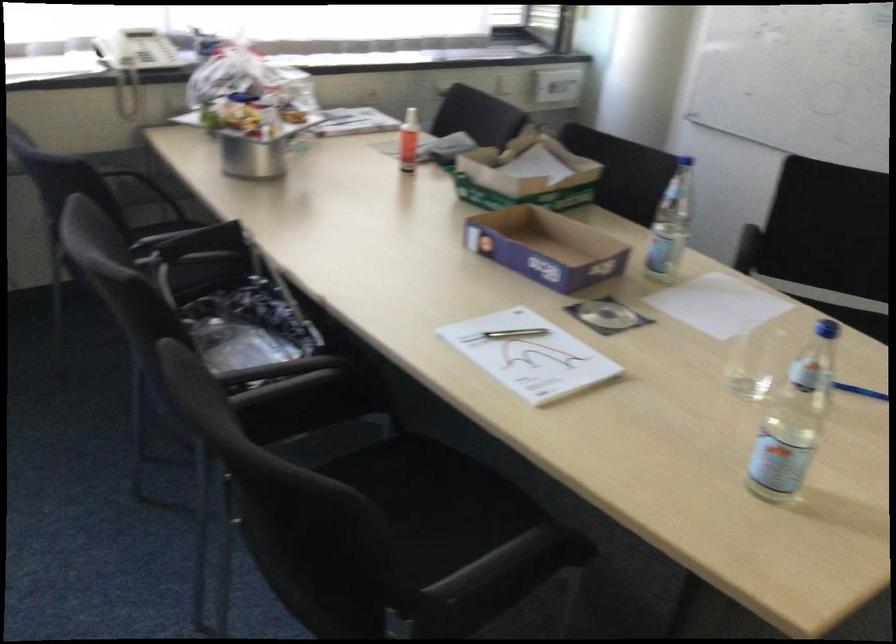
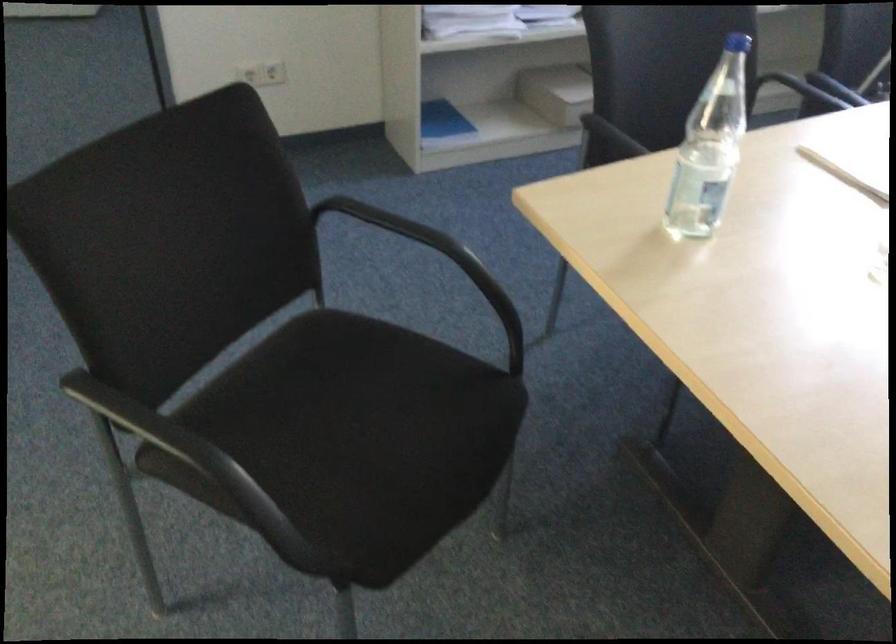
Question: I am providing you with two images of the same scene from different viewpoints. Which of the following objects are not visible in image2?

Choices:
 (A) wooden knife block
 (B) black chair armrest
 (C) plastic water bottle
 (D) black chair sitting surface

Answer: (D)